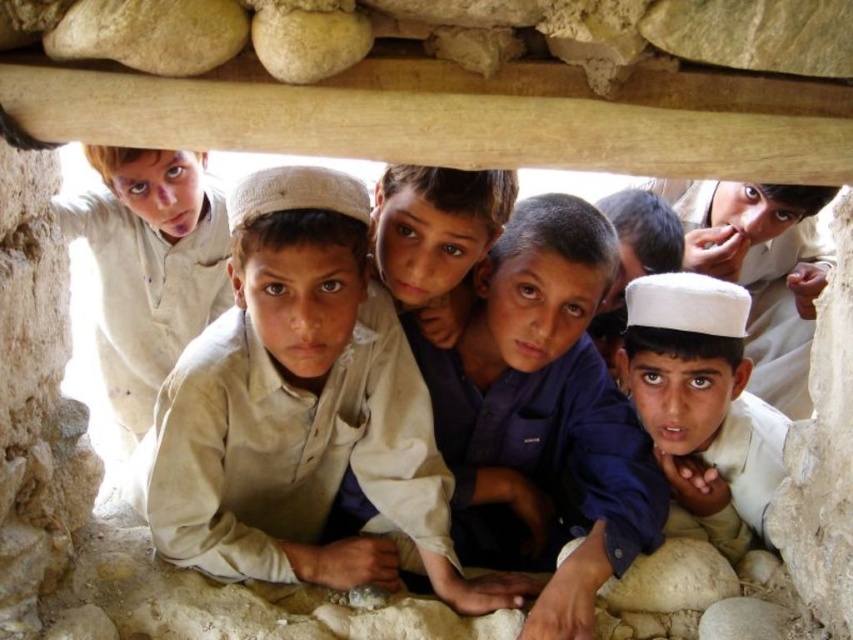
You are a photographer trying to capture the light beige cotton shirt at center in the image. According to the coordinates provided, where should you focus your camera to ensure the shirt is centered in the frame?

The light beige cotton shirt at center is located at coordinates point (x=300, y=410), so you should focus your camera there to center it in the frame.